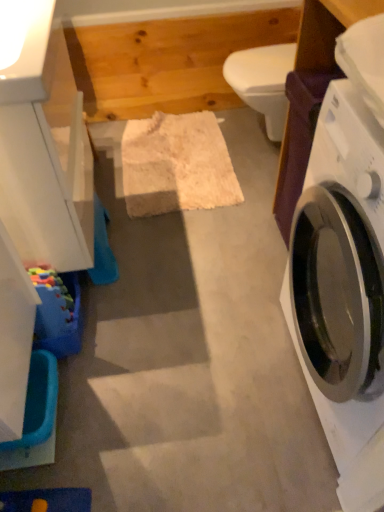
Question: From a real-world perspective, is white glossy toilet bowl at center beneath blue plastic tub at lower left?

Choices:
 (A) yes
 (B) no

Answer: (B)

Question: From a real-world perspective, is white glossy toilet bowl at center on top of blue plastic tub at lower left?

Choices:
 (A) no
 (B) yes

Answer: (B)

Question: Can you confirm if white glossy toilet bowl at center is wider than blue plastic tub at lower left?

Choices:
 (A) yes
 (B) no

Answer: (A)

Question: Considering the relative sizes of white glossy toilet bowl at center and blue plastic tub at lower left in the image provided, is white glossy toilet bowl at center smaller than blue plastic tub at lower left?

Choices:
 (A) yes
 (B) no

Answer: (B)

Question: From the image's perspective, is white glossy toilet bowl at center on blue plastic tub at lower left?

Choices:
 (A) yes
 (B) no

Answer: (A)

Question: Considering the relative sizes of white glossy toilet bowl at center and blue plastic tub at lower left in the image provided, is white glossy toilet bowl at center taller than blue plastic tub at lower left?

Choices:
 (A) no
 (B) yes

Answer: (B)

Question: Does blue plastic tub at lower left have a greater height compared to white glossy washing machine at right?

Choices:
 (A) yes
 (B) no

Answer: (B)

Question: Is blue plastic tub at lower left not inside white glossy washing machine at right?

Choices:
 (A) no
 (B) yes

Answer: (B)

Question: Does blue plastic tub at lower left have a lesser width compared to white glossy washing machine at right?

Choices:
 (A) yes
 (B) no

Answer: (A)

Question: Does blue plastic tub at lower left have a greater width compared to white glossy washing machine at right?

Choices:
 (A) no
 (B) yes

Answer: (A)

Question: Is blue plastic tub at lower left not close to white glossy washing machine at right?

Choices:
 (A) yes
 (B) no

Answer: (B)

Question: Is blue plastic tub at lower left directly adjacent to white glossy washing machine at right?

Choices:
 (A) yes
 (B) no

Answer: (B)

Question: Is white glossy toilet bowl at center behind white glossy washing machine at right?

Choices:
 (A) no
 (B) yes

Answer: (B)